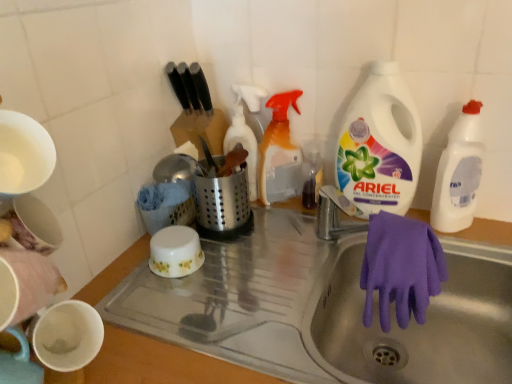
Question: Is white plastic bottle at upper right, the second cleaning product viewed from the right, positioned behind translucent plastic spray bottle at upper center, positioned as the first cleaning product in left-to-right order?

Choices:
 (A) yes
 (B) no

Answer: (B)

Question: Is white plastic bottle at upper right, arranged as the 3th cleaning product when viewed from the left, shorter than translucent plastic spray bottle at upper center, which ranks as the fourth cleaning product in right-to-left order?

Choices:
 (A) yes
 (B) no

Answer: (B)

Question: From the image's perspective, is white plastic bottle at upper right, the second cleaning product viewed from the right, located beneath translucent plastic spray bottle at upper center, which ranks as the fourth cleaning product in right-to-left order?

Choices:
 (A) yes
 (B) no

Answer: (B)

Question: Is white plastic bottle at upper right, the second cleaning product viewed from the right, surrounding translucent plastic spray bottle at upper center, which ranks as the fourth cleaning product in right-to-left order?

Choices:
 (A) yes
 (B) no

Answer: (B)

Question: Considering the relative sizes of white plastic bottle at upper right, the second cleaning product viewed from the right, and translucent plastic spray bottle at upper center, positioned as the first cleaning product in left-to-right order, in the image provided, is white plastic bottle at upper right, the second cleaning product viewed from the right, thinner than translucent plastic spray bottle at upper center, positioned as the first cleaning product in left-to-right order,?

Choices:
 (A) no
 (B) yes

Answer: (A)

Question: Does white plastic bottle at upper right, arranged as the 3th cleaning product when viewed from the left, touch translucent plastic spray bottle at upper center, which ranks as the fourth cleaning product in right-to-left order?

Choices:
 (A) no
 (B) yes

Answer: (A)

Question: Is purple rubber glove at sink smaller than purple rubber glove at lower right?

Choices:
 (A) no
 (B) yes

Answer: (B)

Question: Is purple rubber glove at sink oriented away from purple rubber glove at lower right?

Choices:
 (A) no
 (B) yes

Answer: (A)

Question: Can you confirm if purple rubber glove at sink is shorter than purple rubber glove at lower right?

Choices:
 (A) yes
 (B) no

Answer: (B)

Question: Is purple rubber glove at sink with purple rubber glove at lower right?

Choices:
 (A) no
 (B) yes

Answer: (A)

Question: Considering the relative positions of purple rubber glove at sink and purple rubber glove at lower right in the image provided, is purple rubber glove at sink to the left of purple rubber glove at lower right from the viewer's perspective?

Choices:
 (A) no
 (B) yes

Answer: (A)

Question: From a real-world perspective, is purple rubber glove at sink under purple rubber glove at lower right?

Choices:
 (A) no
 (B) yes

Answer: (A)

Question: Is translucent plastic spray bottle at upper center, positioned as the first cleaning product in left-to-right order, in front of purple rubber glove at sink?

Choices:
 (A) yes
 (B) no

Answer: (B)